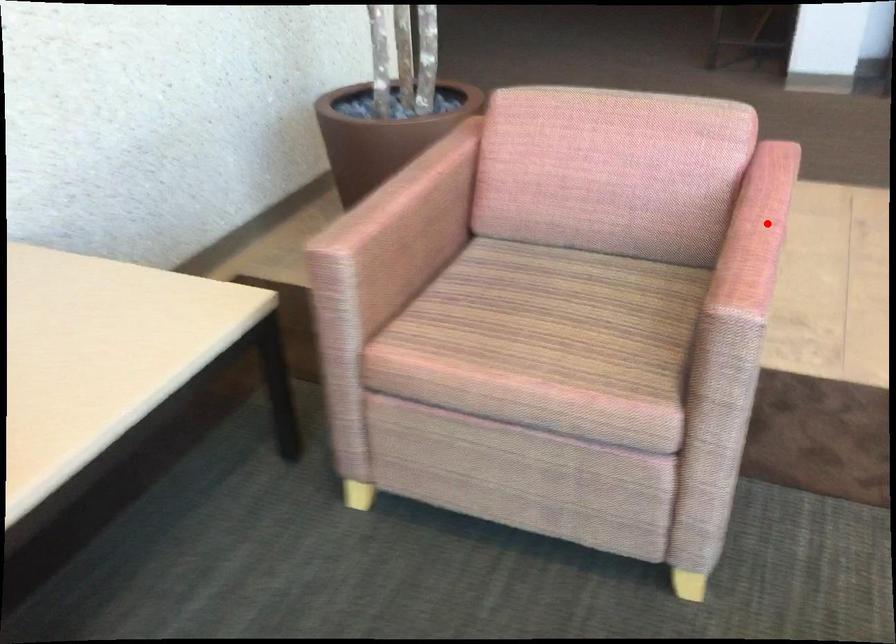
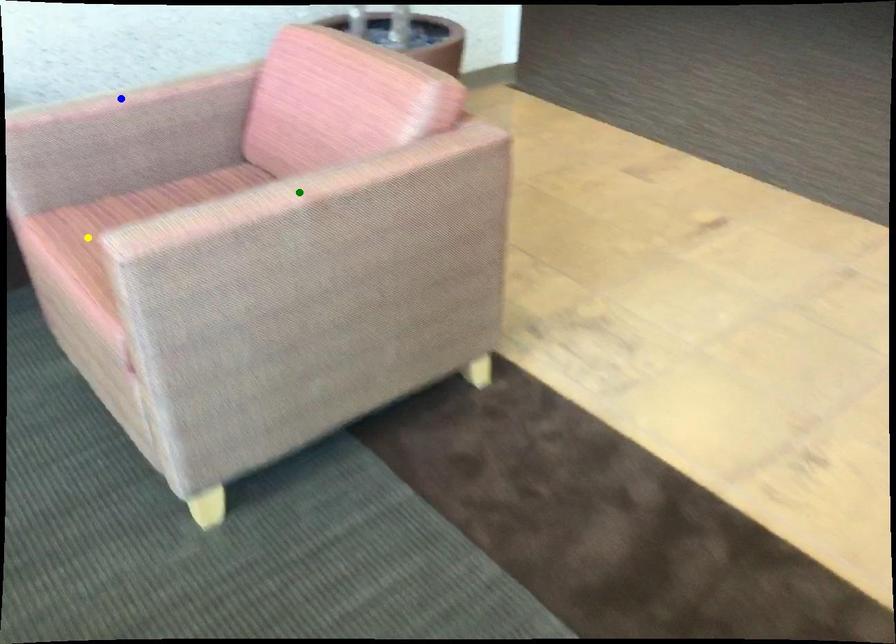
Question: I am providing you with two images of the same scene from different viewpoints. A red point is marked on the first image. You are given multiple points on the second image. In image 2, which mark is for the same physical point as the one in image 1?

Choices:
 (A) yellow point
 (B) blue point
 (C) green point

Answer: (C)